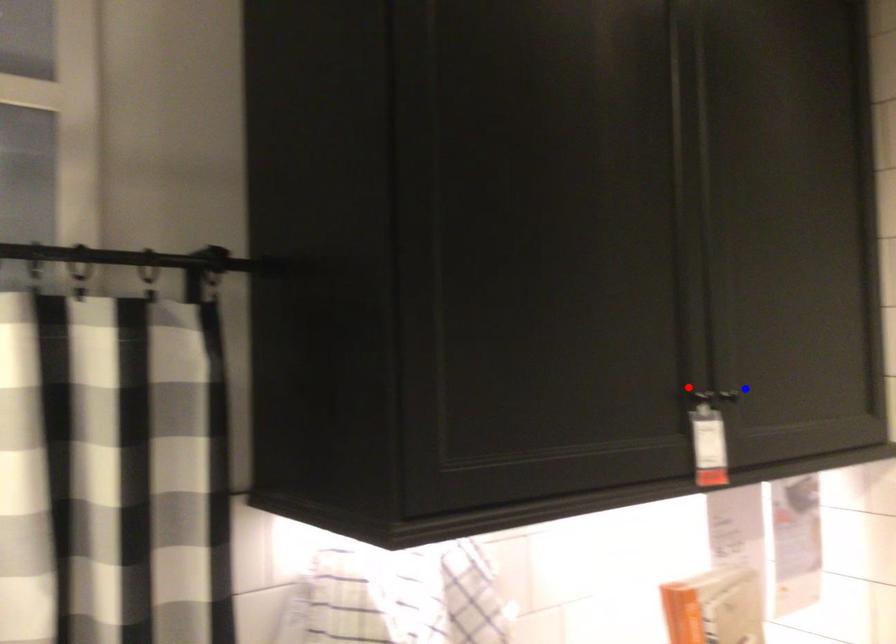
Question: In the image, two points are highlighted. Which point is nearer to the camera? Reply with the corresponding letter.

Choices:
 (A) blue point
 (B) red point

Answer: (B)